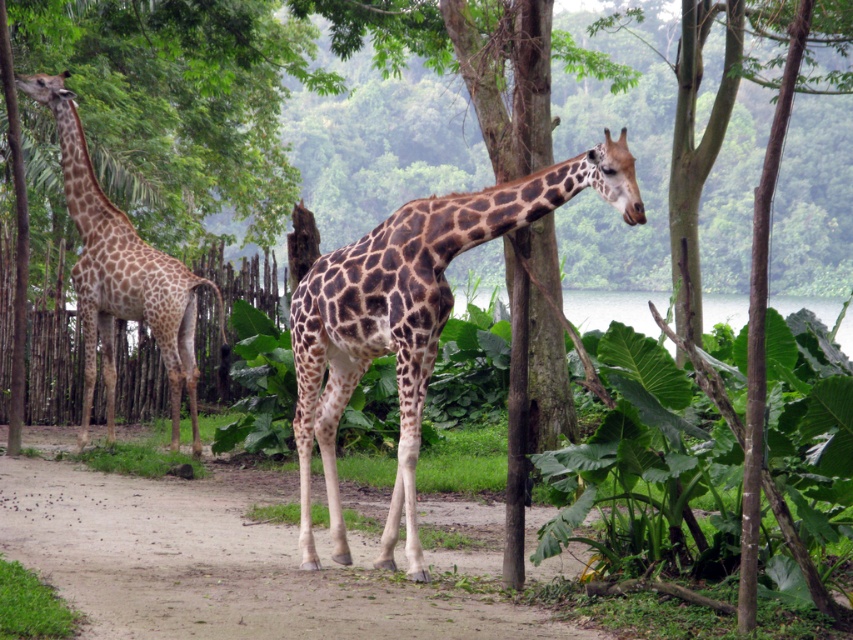
Question: Estimate the real-world distances between objects in this image. Which object is closer to the spotted fur giraffe at left?

Choices:
 (A) dusty sand path at lower center
 (B) green leafy plant at center
 (C) spotted fur giraffe at center

Answer: (A)

Question: Among these points, which one is nearest to the camera?

Choices:
 (A) (109, 243)
 (B) (735, 460)
 (C) (294, 365)

Answer: (B)

Question: Is dusty sand path at lower center to the right of spotted fur giraffe at center from the viewer's perspective?

Choices:
 (A) yes
 (B) no

Answer: (B)

Question: Among these objects, which one is farthest from the camera?

Choices:
 (A) dusty sand path at lower center
 (B) spotted fur giraffe at left
 (C) green leafy plant at center

Answer: (B)

Question: Is dusty sand path at lower center bigger than spotted fur giraffe at center?

Choices:
 (A) yes
 (B) no

Answer: (B)

Question: Is dusty sand path at lower center bigger than spotted fur giraffe at left?

Choices:
 (A) no
 (B) yes

Answer: (A)